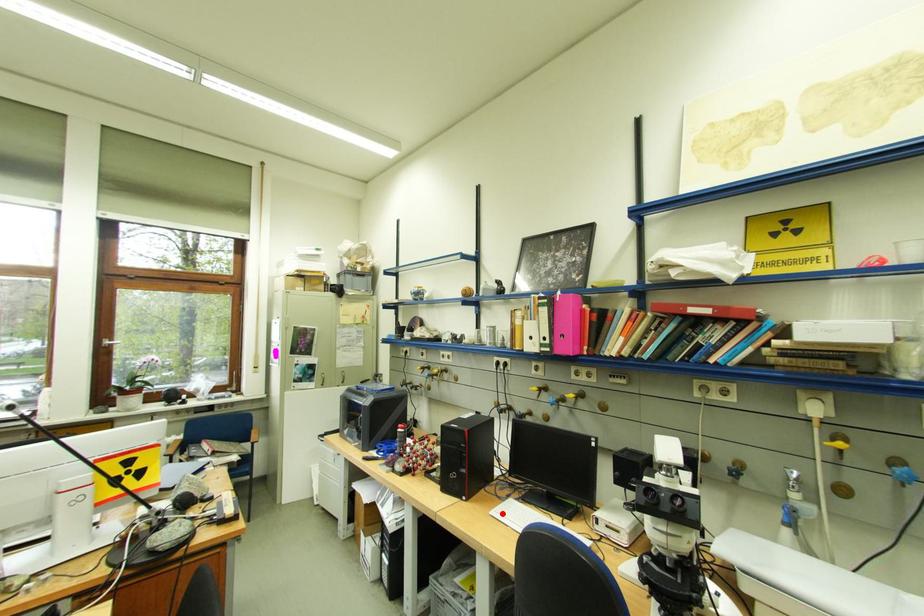
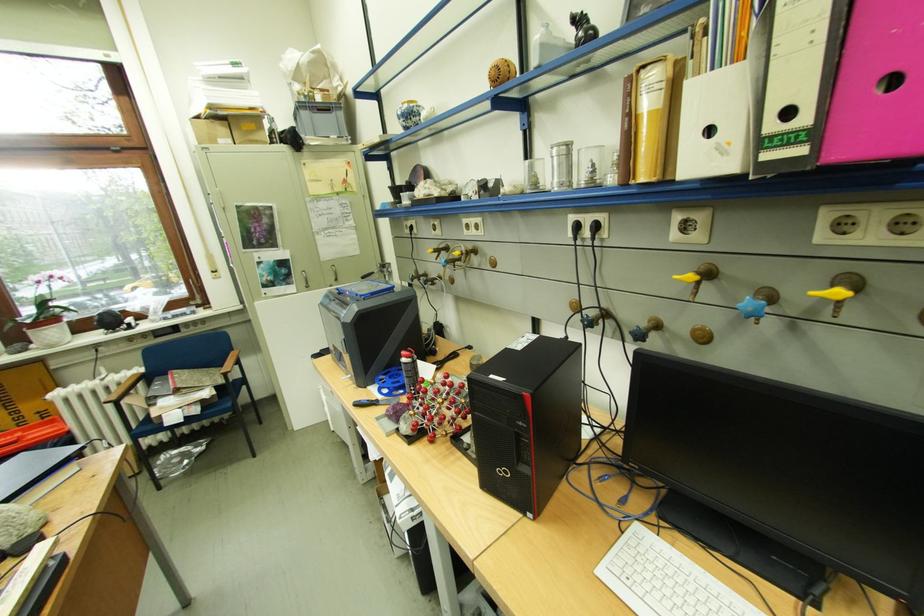
Question: I am providing you with two images of the same scene from different viewpoints. A red point is marked on the first image. At the location where the point appears in image 1, is it still visible in image 2?

Choices:
 (A) Yes
 (B) No

Answer: (A)